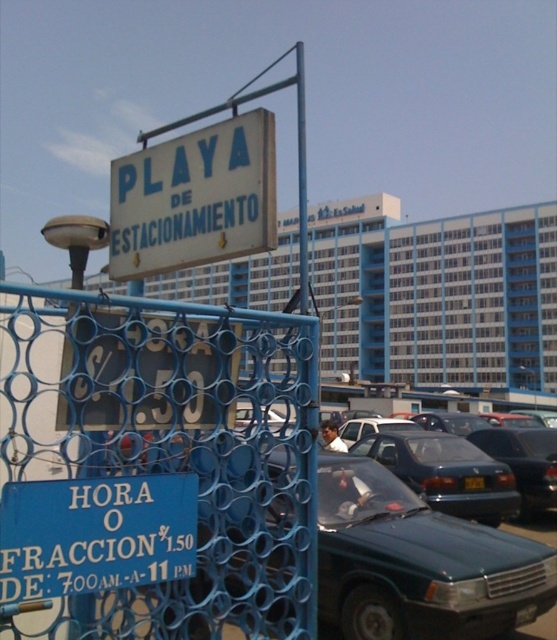
Question: Considering the relative positions of green matte car at center and white painted wood sign at upper center in the image provided, where is green matte car at center located with respect to white painted wood sign at upper center?

Choices:
 (A) right
 (B) left

Answer: (A)

Question: Which of the following is the farthest from the observer?

Choices:
 (A) (207, 257)
 (B) (409, 548)
 (C) (458, 484)

Answer: (C)

Question: Does green matte car at center have a lesser width compared to shiny black sedan at center?

Choices:
 (A) yes
 (B) no

Answer: (A)

Question: Does blue mesh fence at center have a smaller size compared to green matte car at center?

Choices:
 (A) yes
 (B) no

Answer: (B)

Question: Which point is farther from the camera taking this photo?

Choices:
 (A) (416, 620)
 (B) (265, 156)
 (C) (177, 513)
 (D) (418, 458)

Answer: (D)

Question: Among these objects, which one is farthest from the camera?

Choices:
 (A) green matte car at center
 (B) blue mesh fence at center

Answer: (A)